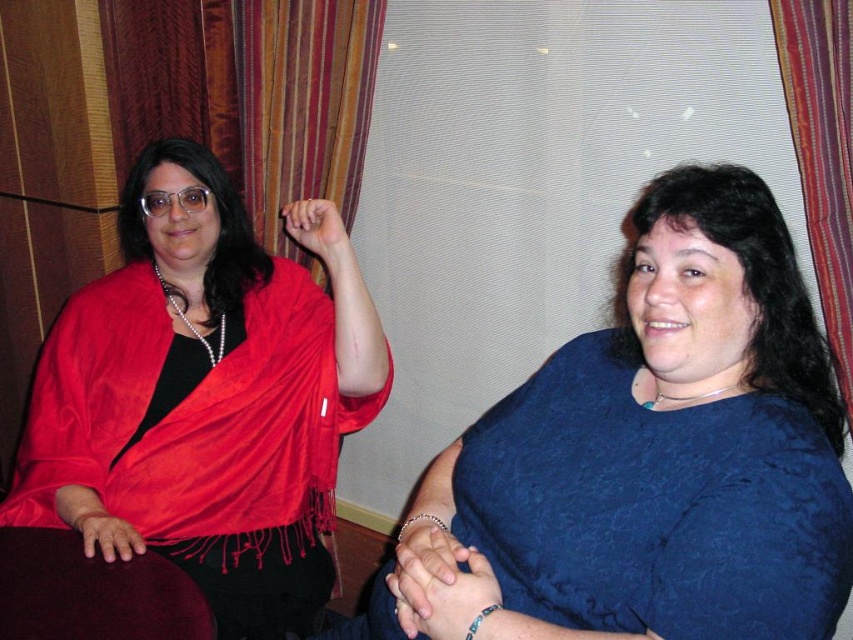
Is blue satin blouse at center taller than striped fabric curtain at right?

Incorrect, blue satin blouse at center's height is not larger of striped fabric curtain at right's.

Who is positioned more to the left, blue satin blouse at center or striped fabric curtain at right?

blue satin blouse at center

What do you see at coordinates (668, 428) in the screenshot?
I see `blue satin blouse at center` at bounding box center [668, 428].

You are a GUI agent. You are given a task and a screenshot of the screen. Output one action in this format:
    pyautogui.click(x=<x>, y=<y>)
    Task: Click on the blue satin blouse at center
    Image resolution: width=853 pixels, height=640 pixels.
    Given the screenshot: What is the action you would take?
    pyautogui.click(x=668, y=428)

How much distance is there between satin red scarf at left and blue satin blouse at center?

satin red scarf at left is 25.81 inches from blue satin blouse at center.

Between point (135, 316) and point (822, 378), which one is positioned behind?

The point (135, 316) is behind.

I want to click on satin red scarf at left, so click(206, 396).

Measure the distance between point (274, 323) and camera.

A distance of 5.62 feet exists between point (274, 323) and camera.

Is satin red scarf at left above striped fabric curtain at right?

Actually, satin red scarf at left is below striped fabric curtain at right.

Does point (242, 531) come in front of point (846, 236)?

No, (242, 531) is further to viewer.

Identify the location of satin red scarf at left. The height and width of the screenshot is (640, 853). (206, 396).